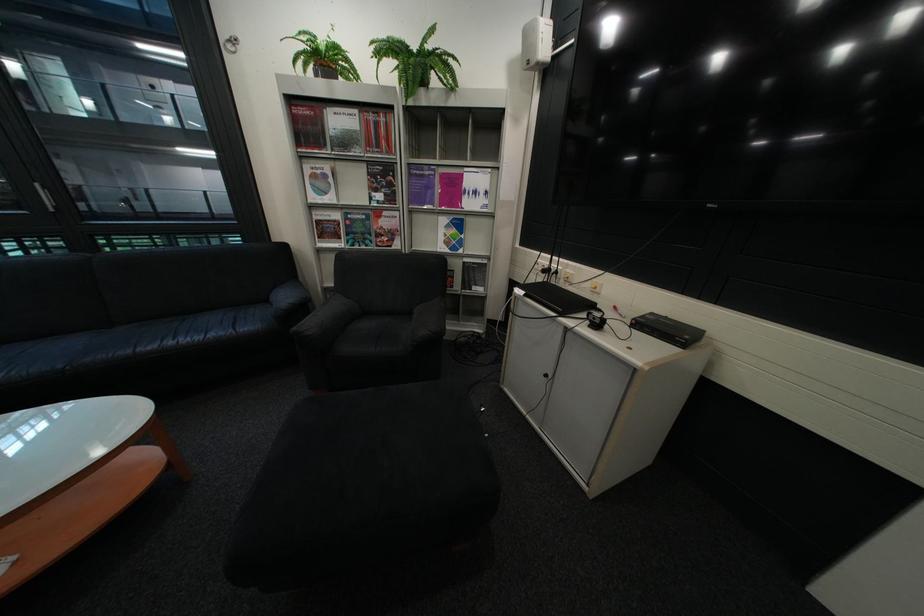
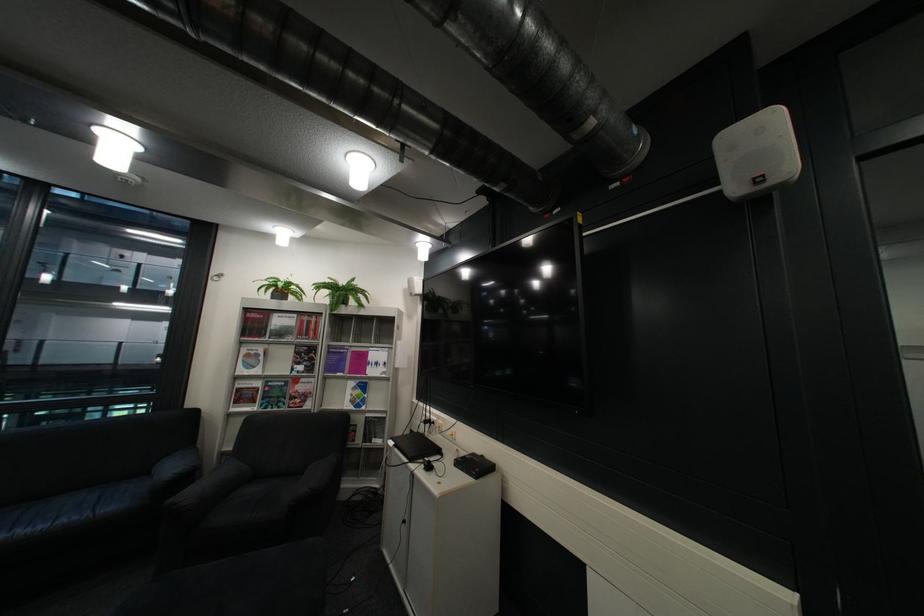
Locate, in the second image, the point that corresponds to (x=213, y=338) in the first image.

(58, 527)